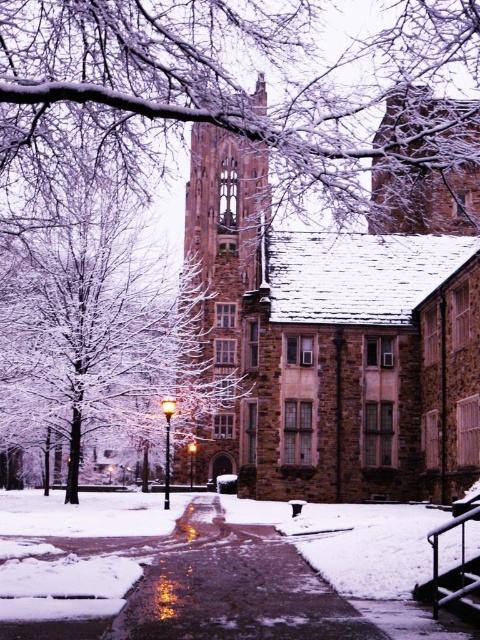
Question: Where is brown stone church at center located in relation to snow-covered branches at upper center in the image?

Choices:
 (A) right
 (B) left

Answer: (B)

Question: Which point is closer to the camera?

Choices:
 (A) (60, 60)
 (B) (388, 182)

Answer: (A)

Question: Among these points, which one is farthest from the camera?

Choices:
 (A) (233, 369)
 (B) (314, 68)

Answer: (A)

Question: Is brown stone church at center above snow-covered branches at upper center?

Choices:
 (A) no
 (B) yes

Answer: (A)

Question: Is brown stone church at center smaller than snow-covered branches at upper center?

Choices:
 (A) no
 (B) yes

Answer: (B)

Question: Which of the following is the farthest from the observer?

Choices:
 (A) (400, 38)
 (B) (196, 476)

Answer: (B)